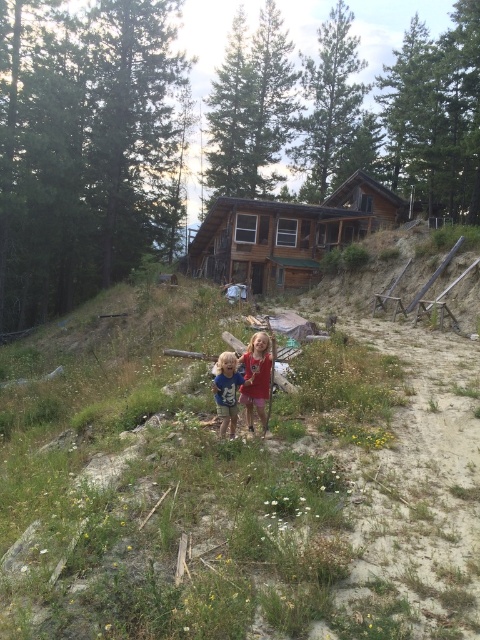
Question: Which point is farther to the camera?

Choices:
 (A) (467, 477)
 (B) (336, 224)
 (C) (267, 348)

Answer: (B)

Question: Which point is closer to the camera?

Choices:
 (A) blue denim shorts at center
 (B) brown wooden log cabin at center

Answer: (A)

Question: Where is brown wooden log cabin at center located in relation to blue denim shorts at center in the image?

Choices:
 (A) above
 (B) below

Answer: (A)

Question: Is green grassy hillside at center smaller than blue denim shorts at center?

Choices:
 (A) yes
 (B) no

Answer: (B)

Question: Among these points, which one is farthest from the camera?

Choices:
 (A) (226, 365)
 (B) (295, 244)

Answer: (B)

Question: Does matte red shirt at center appear under blue denim shorts at center?

Choices:
 (A) no
 (B) yes

Answer: (A)